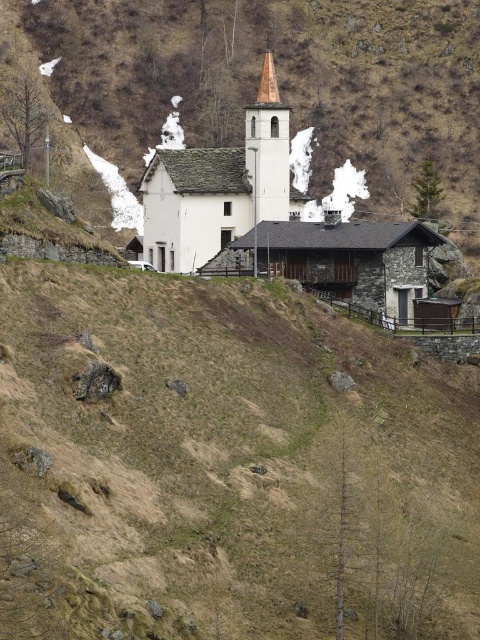
Which is in front, point (195, 474) or point (197, 256)?

Positioned in front is point (195, 474).

Is point (96, 410) positioned behind point (156, 204)?

No, it is not.

Locate an element on the screen. brown grassy hillside at center is located at coordinates (227, 465).

Does white matte church at center have a greater height compared to brown wood spire at center?

Yes, white matte church at center is taller than brown wood spire at center.

Identify the location of white matte church at center. (219, 186).

The image size is (480, 640). What are the coordinates of `white stone church at center` in the screenshot? It's located at 272,218.

The width and height of the screenshot is (480, 640). What are the coordinates of `white stone church at center` in the screenshot? It's located at (272, 218).